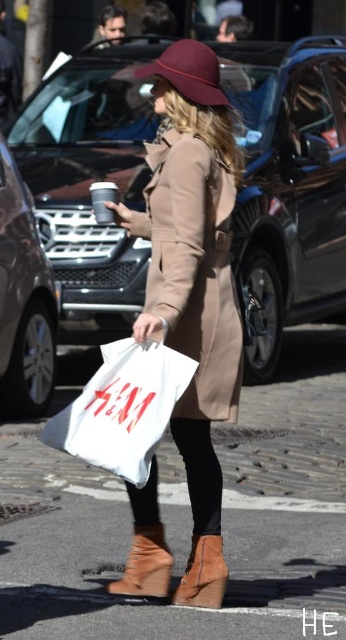
Between tan leather trench coat at center and suede brown boot at lower center, which one is positioned lower?

Positioned lower is suede brown boot at lower center.

Between point (198, 321) and point (220, 548), which one is positioned in front?

Point (198, 321) is in front.

In order to click on tan leather trench coat at center in this screenshot , I will do 194,269.

Who is positioned more to the right, matte beige coat at center or brown suede boot at lower center?

matte beige coat at center

Consider the image. Is matte beige coat at center taller than brown suede boot at lower center?

Yes.

Is point (222, 208) less distant than point (129, 586)?

That is True.

Where is `matte beige coat at center`? matte beige coat at center is located at coordinates (193, 257).

Does point (320, 317) come behind point (166, 184)?

Yes, point (320, 317) is farther from viewer.

Is point (258, 83) farther from viewer compared to point (215, 193)?

Yes.

What are the coordinates of `shiny black car at center` in the screenshot? It's located at (287, 188).